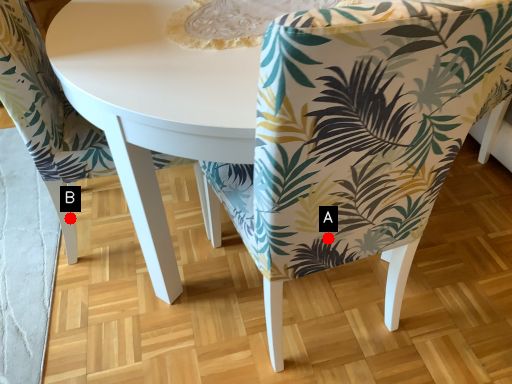
Question: Two points are circled on the image, labeled by A and B beside each circle. Which of the following is the farthest from the observer?

Choices:
 (A) A is further
 (B) B is further

Answer: (B)